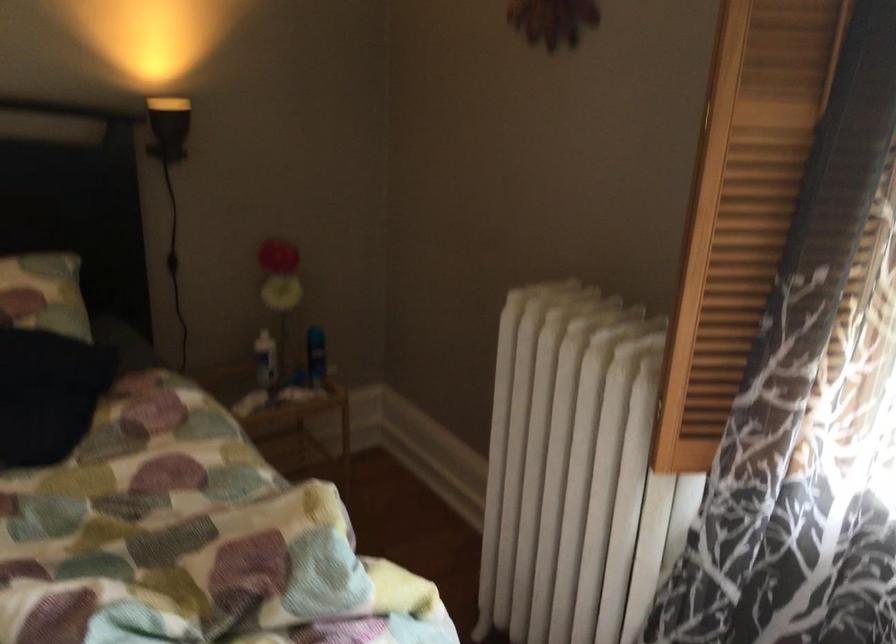
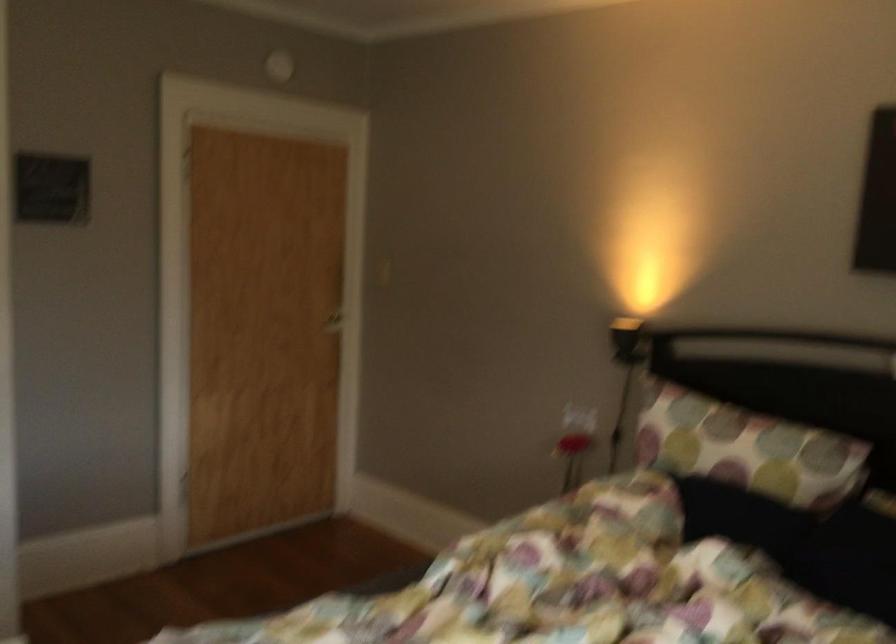
Question: The camera is either moving clockwise (left) or counter-clockwise (right) around the object. The first image is from the beginning of the video and the second image is from the end. Is the camera moving left or right when shooting the video?

Choices:
 (A) Left
 (B) Right

Answer: (B)